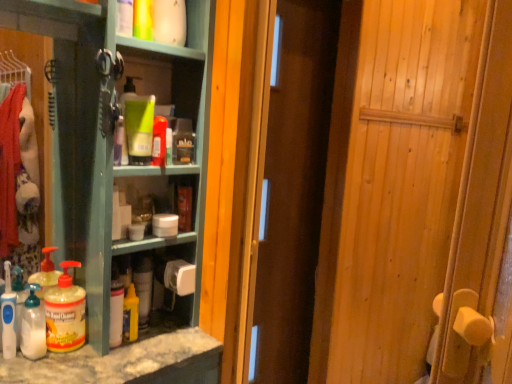
In order to click on translucent plastic soap dispenser at lower left, the 2th cleaning product positioned from the top in this screenshot , I will do `click(8, 316)`.

Measure the distance between point (133, 292) and camera.

They are 1.04 meters apart.

What do you see at coordinates (65, 313) in the screenshot? This screenshot has height=384, width=512. I see `translucent plastic bottle at lower left, placed as the second bottle when sorted from right to left` at bounding box center [65, 313].

You are a GUI agent. You are given a task and a screenshot of the screen. Output one action in this format:
    pyautogui.click(x=<x>, y=<y>)
    Task: Click on the wooden door at center, acting as the first door starting from the back
    The height and width of the screenshot is (384, 512).
    Given the screenshot: What is the action you would take?
    pyautogui.click(x=293, y=188)

Find the location of `white matte bottle at lower center, acting as the 1th bottle starting from the right`. white matte bottle at lower center, acting as the 1th bottle starting from the right is located at coordinates (116, 313).

Is wooden door at center, the second door when ordered from back to front, beside translucent plastic bottle at lower left, positioned as the first bottle in left-to-right order?

No, wooden door at center, the second door when ordered from back to front, is not beside translucent plastic bottle at lower left, positioned as the first bottle in left-to-right order.

Is point (495, 46) in front of point (76, 317)?

Yes, point (495, 46) is closer to viewer.

Looking at the image, does wooden door at center, which is the 1th door from front to back, seem bigger or smaller compared to translucent plastic bottle at lower left, placed as the second bottle when sorted from right to left?

Considering their sizes, wooden door at center, which is the 1th door from front to back, takes up more space than translucent plastic bottle at lower left, placed as the second bottle when sorted from right to left.

In the scene shown: From a real-world perspective, is wooden door at center, the second door when ordered from back to front, on top of translucent plastic bottle at lower left, positioned as the first bottle in left-to-right order?

Indeed, from a real-world perspective, wooden door at center, the second door when ordered from back to front, stands above translucent plastic bottle at lower left, positioned as the first bottle in left-to-right order.

Is wooden door at center, acting as the first door starting from the back, positioned with its back to translucent plastic pump bottle at lower left, which ranks as the third cleaning product in top-to-bottom order?

No, wooden door at center, acting as the first door starting from the back,'s orientation is not away from translucent plastic pump bottle at lower left, which ranks as the third cleaning product in top-to-bottom order.

Is wooden door at center, the 2th door positioned from the front, in front of translucent plastic pump bottle at lower left, the second cleaning product from the left?

No, it is not.

Can you confirm if wooden door at center, acting as the first door starting from the back, is positioned to the right of translucent plastic pump bottle at lower left, acting as the third cleaning product starting from the right?

Yes.

Which of these two, white matte toilet paper at center or wooden door at center, which is the 1th door from front to back, is thinner?

white matte toilet paper at center.

Between point (169, 283) and point (362, 21), which one is positioned in front?

The point (169, 283) is closer to the camera.

Does white matte toilet paper at center contain wooden door at center, which is the 1th door from front to back?

Actually, wooden door at center, which is the 1th door from front to back, is outside white matte toilet paper at center.

Could you measure the distance between white matte toilet paper at center and wooden door at center, the second door when ordered from back to front?

The distance of white matte toilet paper at center from wooden door at center, the second door when ordered from back to front, is 1.33 meters.

Based on their sizes in the image, would you say wooden door at center, the second door when ordered from back to front, is bigger or smaller than white matte toilet paper at center?

Considering their sizes, wooden door at center, the second door when ordered from back to front, takes up more space than white matte toilet paper at center.

Are wooden door at center, which is the 1th door from front to back, and white matte toilet paper at center far apart?

Yes.

From a real-world perspective, is wooden door at center, which is the 1th door from front to back, physically located above or below white matte toilet paper at center?

wooden door at center, which is the 1th door from front to back, is situated higher than white matte toilet paper at center in the real world.

Find the location of a particular element. the 1st door above the white matte toilet paper at center (from the image's perspective) is located at coordinates (417, 194).

In the scene shown: Is wooden door at center, which is the 1th door from front to back, not near yellow matte bottle at center, which is the third cleaning product in left-to-right order?

Yes.

Considering the sizes of objects wooden door at center, the second door when ordered from back to front, and yellow matte bottle at center, which is the third cleaning product in left-to-right order, in the image provided, who is smaller, wooden door at center, the second door when ordered from back to front, or yellow matte bottle at center, which is the third cleaning product in left-to-right order,?

With smaller size is yellow matte bottle at center, which is the third cleaning product in left-to-right order.

From the image's perspective, starting from the wooden door at center, which is the 1th door from front to back, which cleaning product is the 3rd one below? Please provide its 2D coordinates.

[(130, 314)]

Considering the relative sizes of wooden door at center, which is the 1th door from front to back, and yellow matte bottle at center, which is the third cleaning product in left-to-right order, in the image provided, is wooden door at center, which is the 1th door from front to back, thinner than yellow matte bottle at center, which is the third cleaning product in left-to-right order,?

No.

Are yellow matte bottle at center, which is the third cleaning product in left-to-right order, and wooden door at center, acting as the first door starting from the back, far apart?

No, yellow matte bottle at center, which is the third cleaning product in left-to-right order, is not far from wooden door at center, acting as the first door starting from the back.

From a real-world perspective, is yellow matte bottle at center, which is the third cleaning product in left-to-right order, located higher than wooden door at center, acting as the first door starting from the back?

No, from a real-world perspective, yellow matte bottle at center, which is the third cleaning product in left-to-right order, is not over wooden door at center, acting as the first door starting from the back

Considering the sizes of objects yellow matte bottle at center, placed as the fourth cleaning product when sorted from top to bottom, and wooden door at center, acting as the first door starting from the back, in the image provided, who is thinner, yellow matte bottle at center, placed as the fourth cleaning product when sorted from top to bottom, or wooden door at center, acting as the first door starting from the back,?

yellow matte bottle at center, placed as the fourth cleaning product when sorted from top to bottom.

Does yellow matte bottle at center, the first cleaning product ordered from the bottom, turn towards wooden door at center, acting as the first door starting from the back?

No, yellow matte bottle at center, the first cleaning product ordered from the bottom, is not aimed at wooden door at center, acting as the first door starting from the back.

Is the surface of translucent plastic soap dispenser at lower left, the third cleaning product in the bottom-to-top sequence, in direct contact with green matte bottle at center, which appears as the 4th cleaning product when viewed from the left?

No.

Considering the sizes of objects translucent plastic soap dispenser at lower left, which appears as the 4th cleaning product when viewed from the right, and green matte bottle at center, placed as the 4th cleaning product when sorted from bottom to top, in the image provided, who is taller, translucent plastic soap dispenser at lower left, which appears as the 4th cleaning product when viewed from the right, or green matte bottle at center, placed as the 4th cleaning product when sorted from bottom to top,?

translucent plastic soap dispenser at lower left, which appears as the 4th cleaning product when viewed from the right.

From the image's perspective, is translucent plastic soap dispenser at lower left, the 2th cleaning product positioned from the top, positioned above or below green matte bottle at center, which appears as the 4th cleaning product when viewed from the left?

translucent plastic soap dispenser at lower left, the 2th cleaning product positioned from the top, is situated lower than green matte bottle at center, which appears as the 4th cleaning product when viewed from the left, in the image.

Looking at this image, in the image, is translucent plastic soap dispenser at lower left, the first cleaning product viewed from the left, positioned in front of or behind green matte bottle at center, acting as the first cleaning product starting from the right?

translucent plastic soap dispenser at lower left, the first cleaning product viewed from the left, is positioned closer to the viewer than green matte bottle at center, acting as the first cleaning product starting from the right.

Where is `door in front of the translucent plastic bottle at lower left, positioned as the first bottle in left-to-right order`? The image size is (512, 384). door in front of the translucent plastic bottle at lower left, positioned as the first bottle in left-to-right order is located at coordinates (417, 194).

At what (x,y) coordinates should I click in order to perform the action: click on door that is the 1st object above the translucent plastic pump bottle at lower left, which ranks as the 2th cleaning product in bottom-to-top order (from a real-world perspective). Please return your answer as a coordinate pair (x, y). The width and height of the screenshot is (512, 384). Looking at the image, I should click on (293, 188).

Consider the image. Considering their positions, is wooden door at center, which is the 1th door from front to back, positioned closer to yellow matte bottle at center, which is the third cleaning product in left-to-right order, than translucent plastic soap dispenser at lower left, which appears as the 4th cleaning product when viewed from the right?

Among the two, translucent plastic soap dispenser at lower left, which appears as the 4th cleaning product when viewed from the right, is located nearer to yellow matte bottle at center, which is the third cleaning product in left-to-right order.

Considering their positions, is yellow matte bottle at center, placed as the fourth cleaning product when sorted from top to bottom, positioned closer to wooden door at center, acting as the first door starting from the back, than white matte bottle at lower center, acting as the 1th bottle starting from the right?

yellow matte bottle at center, placed as the fourth cleaning product when sorted from top to bottom, is positioned closer to the anchor wooden door at center, acting as the first door starting from the back.

Looking at the image, which one is located further to green matte bottle at center, which appears as the 4th cleaning product when viewed from the left, wooden door at center, the second door when ordered from back to front, or white matte bottle at lower center, positioned as the 2th bottle in left-to-right order?

Based on the image, wooden door at center, the second door when ordered from back to front, appears to be further to green matte bottle at center, which appears as the 4th cleaning product when viewed from the left.

Based on their spatial positions, is translucent plastic bottle at lower left, positioned as the first bottle in left-to-right order, or green matte bottle at center, which appears as the 4th cleaning product when viewed from the left, closer to yellow matte bottle at center, the first cleaning product ordered from the bottom?

translucent plastic bottle at lower left, positioned as the first bottle in left-to-right order.

Considering their positions, is white matte bottle at lower center, acting as the 1th bottle starting from the right, positioned further to white matte toilet paper at center than green matte bottle at center, which appears as the 4th cleaning product when viewed from the left?

Among the two, green matte bottle at center, which appears as the 4th cleaning product when viewed from the left, is located further to white matte toilet paper at center.

Estimate the real-world distances between objects in this image. Which object is closer to yellow matte bottle at center, placed as the fourth cleaning product when sorted from top to bottom, wooden door at center, acting as the first door starting from the back, or translucent plastic pump bottle at lower left, which ranks as the 2th cleaning product in bottom-to-top order?

translucent plastic pump bottle at lower left, which ranks as the 2th cleaning product in bottom-to-top order, lies closer to yellow matte bottle at center, placed as the fourth cleaning product when sorted from top to bottom, than the other object.

Considering their positions, is yellow matte bottle at center, the first cleaning product ordered from the bottom, positioned further to white matte toilet paper at center than wooden door at center, acting as the first door starting from the back?

Based on the image, wooden door at center, acting as the first door starting from the back, appears to be further to white matte toilet paper at center.

Looking at the image, which one is located closer to white matte bottle at lower center, positioned as the 2th bottle in left-to-right order, wooden door at center, the 2th door positioned from the front, or white matte toilet paper at center?

white matte toilet paper at center is closer to white matte bottle at lower center, positioned as the 2th bottle in left-to-right order.

This screenshot has height=384, width=512. What are the coordinates of `bottle located between translucent plastic bottle at lower left, placed as the second bottle when sorted from right to left, and wooden door at center, the second door when ordered from back to front, in the left-right direction` in the screenshot? It's located at (116, 313).

The height and width of the screenshot is (384, 512). Find the location of `toilet paper between wooden door at center, which is the 1th door from front to back, and wooden door at center, acting as the first door starting from the back, from front to back`. toilet paper between wooden door at center, which is the 1th door from front to back, and wooden door at center, acting as the first door starting from the back, from front to back is located at coordinates tap(180, 277).

Where is `toilet paper between green matte bottle at center, placed as the 4th cleaning product when sorted from bottom to top, and yellow matte bottle at center, the first cleaning product ordered from the bottom, from top to bottom`? The width and height of the screenshot is (512, 384). toilet paper between green matte bottle at center, placed as the 4th cleaning product when sorted from bottom to top, and yellow matte bottle at center, the first cleaning product ordered from the bottom, from top to bottom is located at coordinates (180, 277).

Find the location of a particular element. The height and width of the screenshot is (384, 512). toilet paper between white matte bottle at lower center, positioned as the 2th bottle in left-to-right order, and wooden door at center, the 2th door positioned from the front, from front to back is located at coordinates (180, 277).